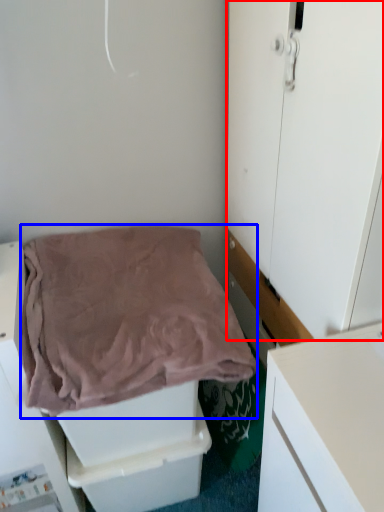
Question: Among these objects, which one is nearest to the camera, door (highlighted by a red box) or blanket (highlighted by a blue box)?

Choices:
 (A) door
 (B) blanket

Answer: (A)